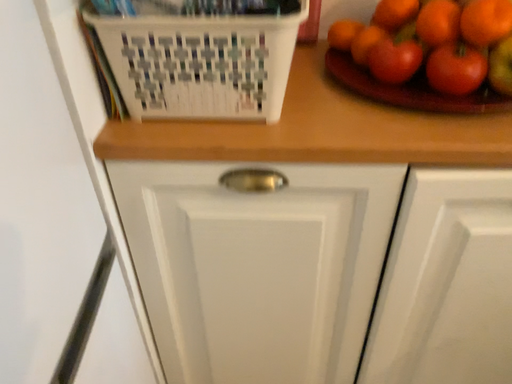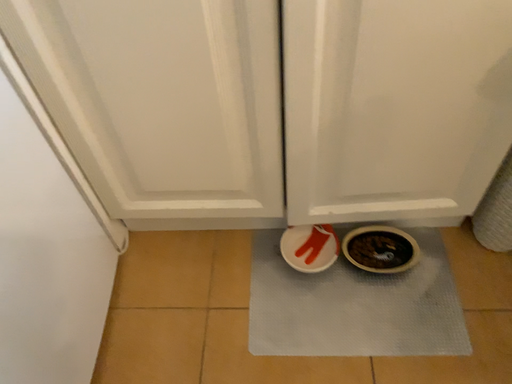
Question: Which way did the camera rotate in the video?

Choices:
 (A) rotated upward
 (B) rotated downward

Answer: (B)